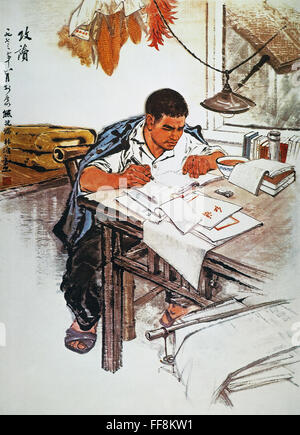
Identify the location of window. (270, 106).